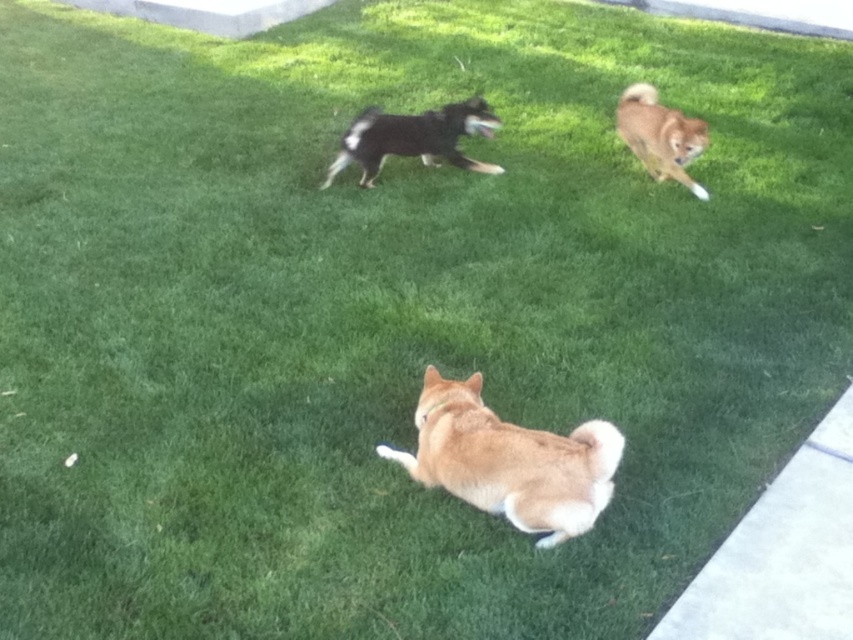
Can you confirm if light brown fur at center is wider than black glossy dog at center?

In fact, light brown fur at center might be narrower than black glossy dog at center.

Does light brown fur at center appear on the right side of black glossy dog at center?

Yes, light brown fur at center is to the right of black glossy dog at center.

This screenshot has width=853, height=640. Identify the location of light brown fur at center. (509, 461).

This screenshot has height=640, width=853. Find the location of `light brown fur at center`. light brown fur at center is located at coordinates (509, 461).

Who is shorter, black glossy dog at center or light brown fur at upper right?

Standing shorter between the two is black glossy dog at center.

Which is above, black glossy dog at center or light brown fur at upper right?

Positioned higher is light brown fur at upper right.

Measure the distance between point (395, 122) and camera.

The distance of point (395, 122) from camera is 13.12 feet.

Locate an element on the screen. This screenshot has height=640, width=853. black glossy dog at center is located at coordinates (413, 138).

Does light brown fur at center lie in front of light brown fur at upper right?

Yes, light brown fur at center is in front of light brown fur at upper right.

Between light brown fur at center and light brown fur at upper right, which one has less height?

With less height is light brown fur at center.

Is point (577, 476) less distant than point (660, 113)?

Yes, it is.

Identify the location of light brown fur at center. The image size is (853, 640). (509, 461).